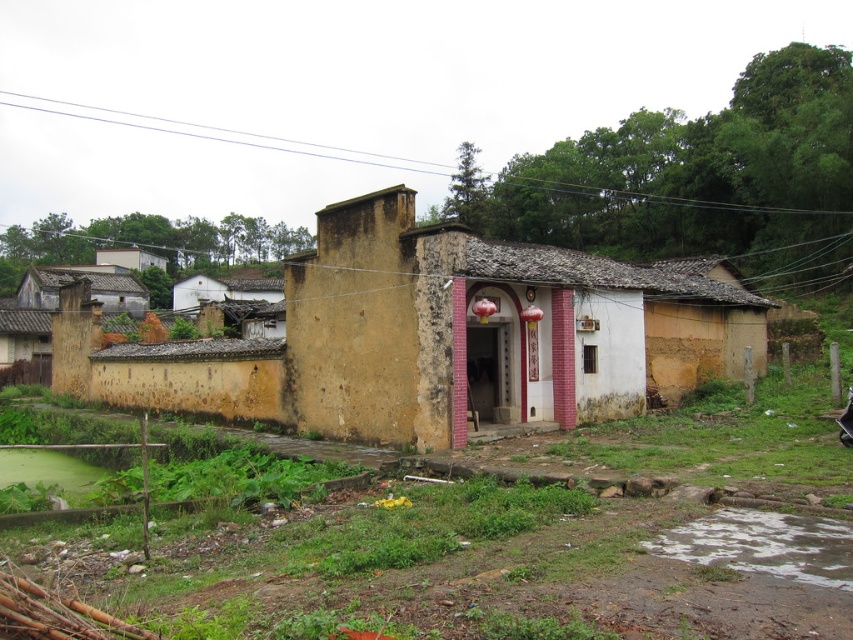
Does yellow stucco house at center come in front of rusty metal hut at left?

That is True.

Consider the image. Does yellow stucco house at center appear under rusty metal hut at left?

Yes, yellow stucco house at center is below rusty metal hut at left.

You are a GUI agent. You are given a task and a screenshot of the screen. Output one action in this format:
    pyautogui.click(x=<x>, y=<y>)
    Task: Click on the yellow stucco house at center
    
    Given the screenshot: What is the action you would take?
    pyautogui.click(x=430, y=337)